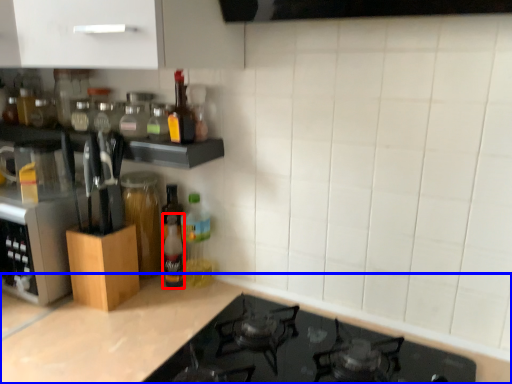
Question: Which object is further to the camera taking this photo, bottle (highlighted by a red box) or countertop (highlighted by a blue box)?

Choices:
 (A) bottle
 (B) countertop

Answer: (A)